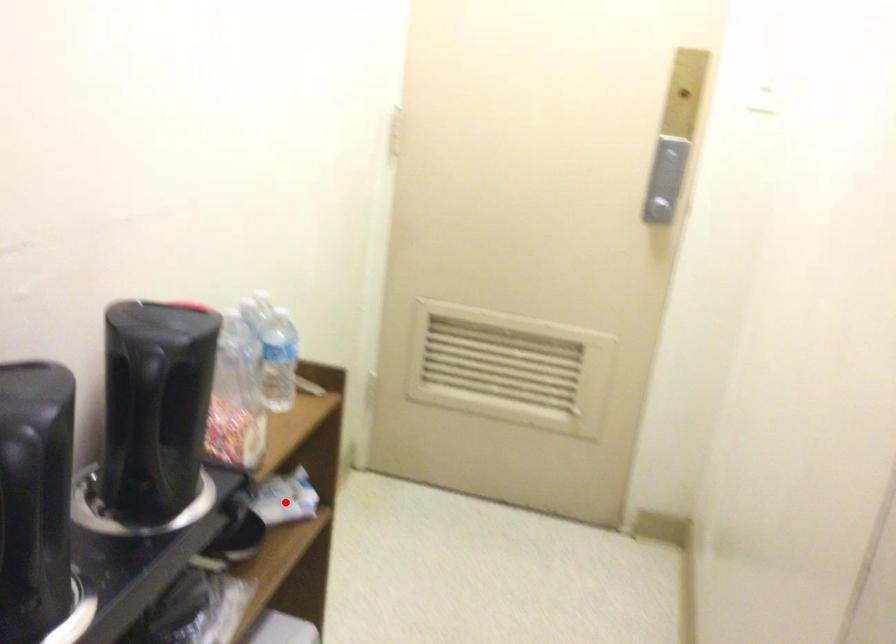
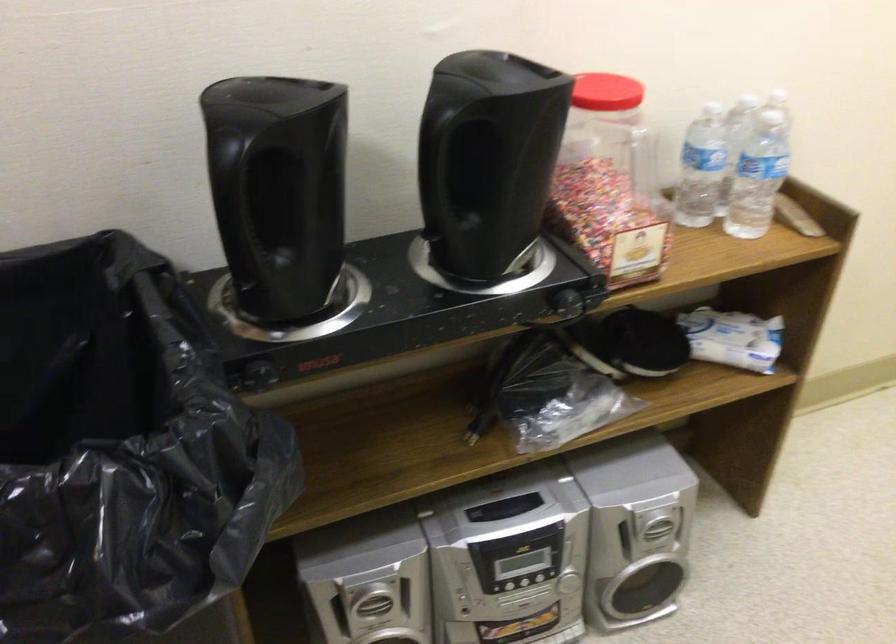
Question: I am providing you with two images of the same scene from different viewpoints. Given a red point in image1, look at the same physical point in image2. Is it:

Choices:
 (A) Closer to the viewpoint
 (B) Farther from the viewpoint

Answer: (A)